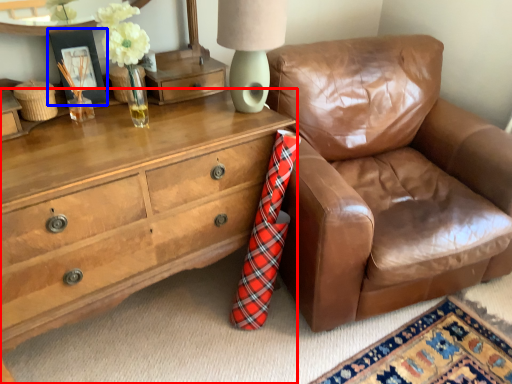
Question: Which object appears farthest to the camera in this image, chest of drawers (highlighted by a red box) or picture frame (highlighted by a blue box)?

Choices:
 (A) chest of drawers
 (B) picture frame

Answer: (B)